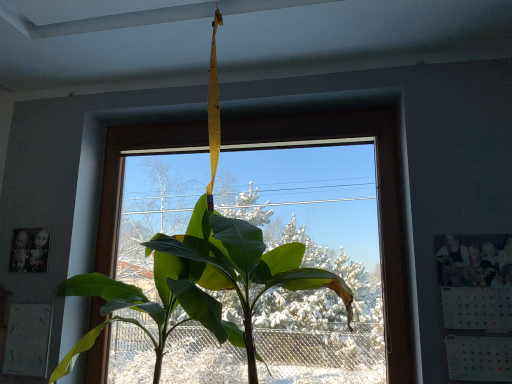
What do you see at coordinates (203, 283) in the screenshot? The width and height of the screenshot is (512, 384). I see `green matte leafy plant at center` at bounding box center [203, 283].

Where is `green matte leafy plant at center`? The image size is (512, 384). green matte leafy plant at center is located at coordinates (203, 283).

Find the location of a particular element. This screenshot has height=384, width=512. green matte leafy plant at center is located at coordinates (203, 283).